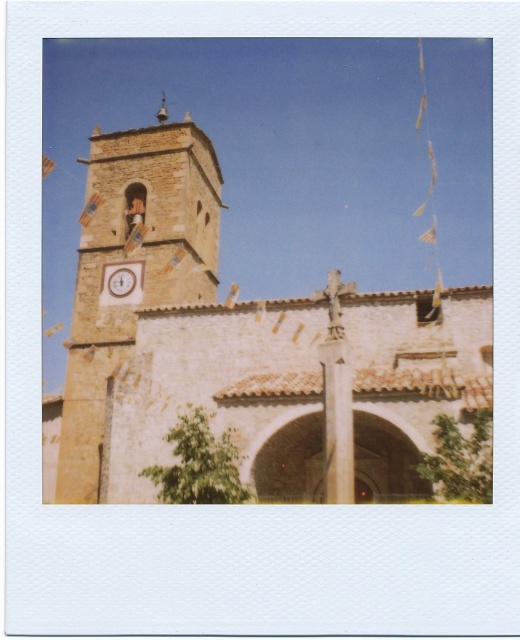
You are standing in front of the church and want to take a photo that includes both the beige stone church at center and the white stone statue at center. Which object should you frame first in your camera to ensure both are fully visible?

The beige stone church at center is bigger than the white stone statue at center, so you should frame the beige stone church at center first to ensure the entire statue fits in the frame.

You are standing in front of the beige stone clock tower at left and want to see the beige stone church at center. In which direction should you look relative to the tower?

The beige stone church at center is below the beige stone clock tower at left, so you should look downward to see it.